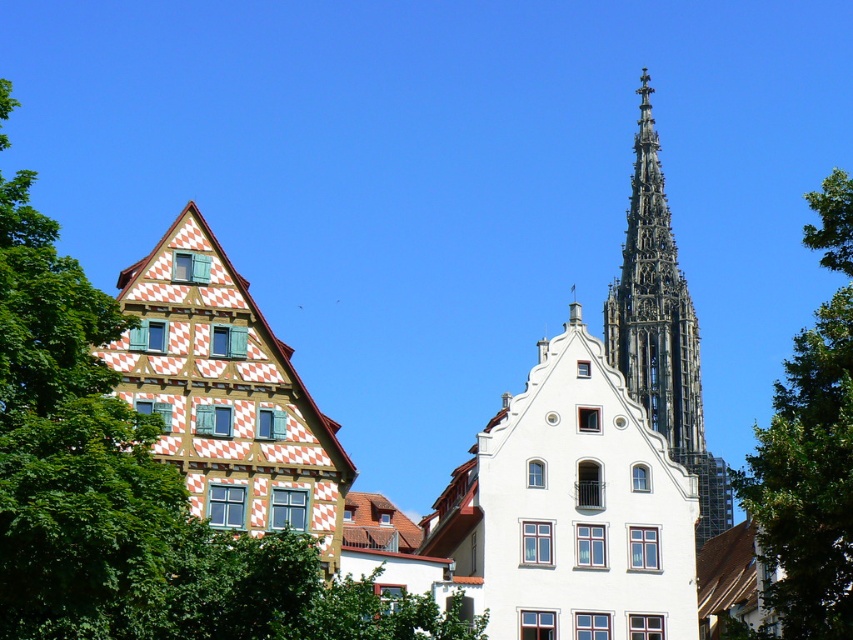
You are standing in the middle of the scene and see the green leafy tree at left and the green leafy tree at upper right. Which tree is positioned more to your left?

The green leafy tree at left is positioned more to the left than the green leafy tree at upper right.

You are an architect analyzing the layout of the two buildings in the image. You notice the green leafy tree at upper right and the dark gray stone spire at upper right. Which object is closer to the right edge of the image?

The green leafy tree at upper right is positioned on the right side of dark gray stone spire at upper right, so the green leafy tree at upper right is closer to the right edge of the image.

You are standing at the center of the image and want to walk towards the green leafy tree at left. In which direction should you move?

The green leafy tree at left is located at point 0.770 on the x axis and 0.156 on the y axis. Since you are at the center, you should move towards the left and slightly downward to reach the green leafy tree at left.